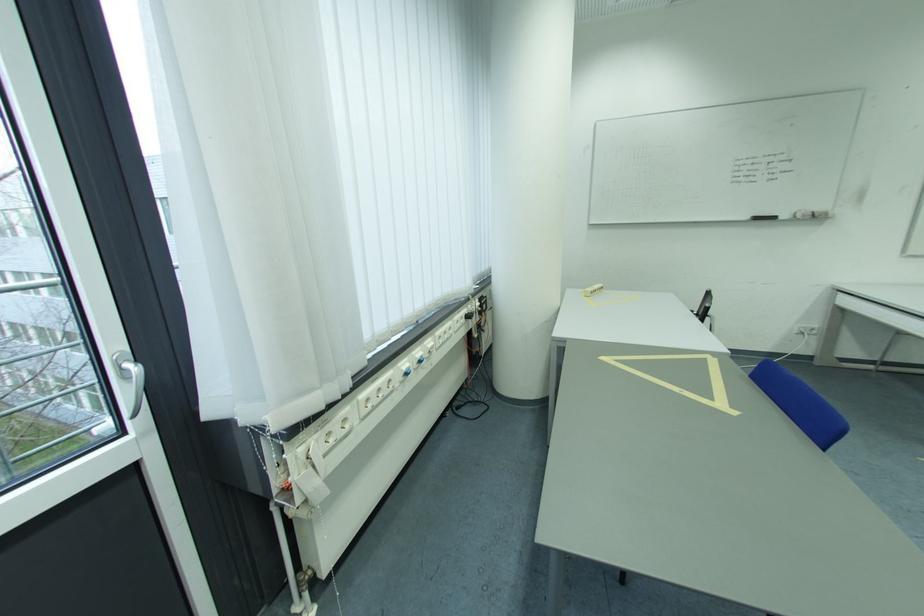
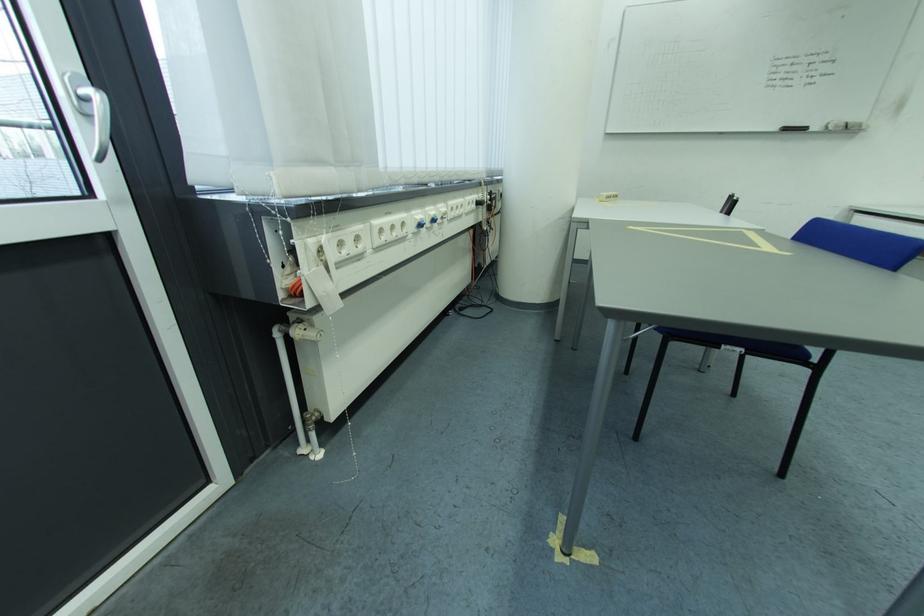
The point at (811, 217) is marked in the first image. Where is the corresponding point in the second image?

(845, 129)